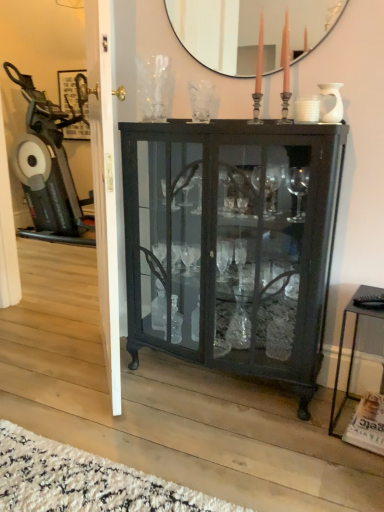
The width and height of the screenshot is (384, 512). I want to click on free space in front of matte black cabinet at center, so click(x=222, y=450).